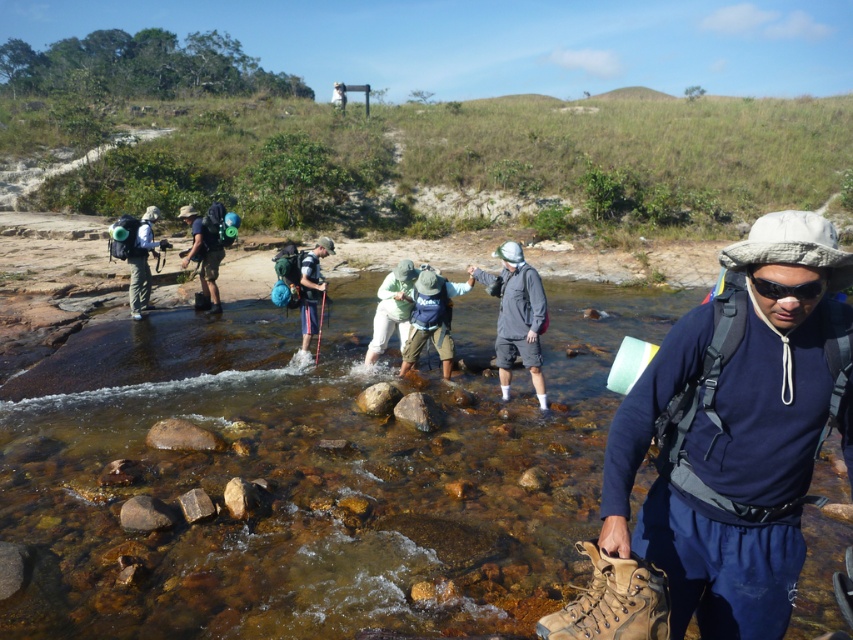
Question: Which object appears closest to the camera in this image?

Choices:
 (A) gray matte shorts at center
 (B) blue fabric backpack at center
 (C) light green fabric jacket at center
 (D) matte blue backpack at center

Answer: (A)

Question: Is tan suede boot at lower right smaller than gray matte shorts at center?

Choices:
 (A) no
 (B) yes

Answer: (B)

Question: Which object is the farthest from the light green fabric jacket at center?

Choices:
 (A) matte green backpack at center
 (B) blue fabric backpack at center
 (C) tan suede boot at lower right
 (D) matte green backpack at left

Answer: (C)

Question: Is tan suede boot at lower right positioned before matte blue backpack at center?

Choices:
 (A) yes
 (B) no

Answer: (A)

Question: Is the position of matte green backpack at left less distant than that of blue fabric backpack at center?

Choices:
 (A) no
 (B) yes

Answer: (A)

Question: Among these objects, which one is farthest from the camera?

Choices:
 (A) black matte sunglasses at center
 (B) matte green backpack at center

Answer: (B)